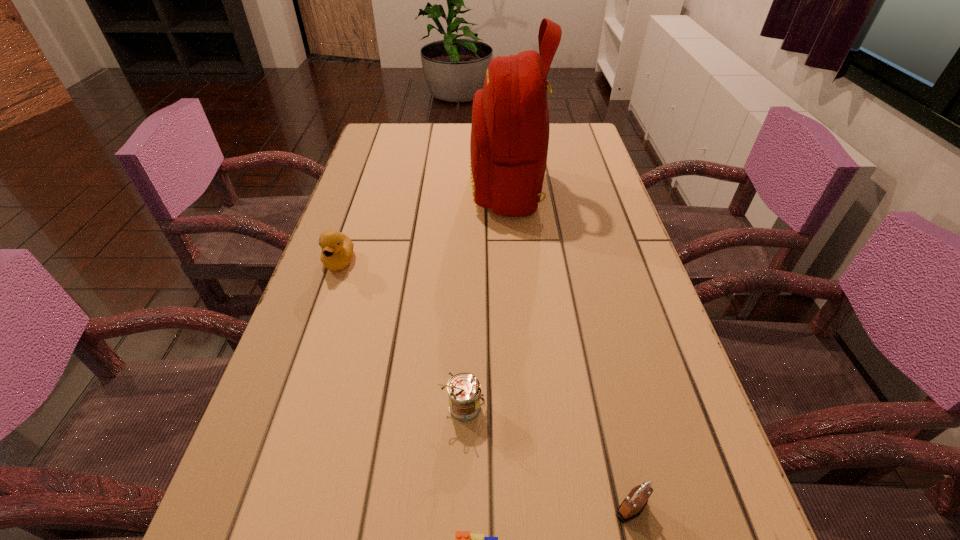
The image size is (960, 540). Identify the location of vacant region that satisfies the following two spatial constraints: 1. on the front-facing side of the backpack; 2. facing forward on the duckling. (513, 261).

You are a GUI agent. You are given a task and a screenshot of the screen. Output one action in this format:
    pyautogui.click(x=<x>, y=<y>)
    Task: Click on the vacant space that satisfies the following two spatial constraints: 1. on the front-facing side of the backpack; 2. facing forward on the leftmost object
    The height and width of the screenshot is (540, 960).
    Given the screenshot: What is the action you would take?
    pyautogui.click(x=513, y=261)

Locate an element on the screen. The width and height of the screenshot is (960, 540). vacant space that satisfies the following two spatial constraints: 1. facing forward on the duckling; 2. on the left side of the can is located at coordinates coord(289,409).

This screenshot has height=540, width=960. What are the coordinates of `free region that satisfies the following two spatial constraints: 1. on the front-facing side of the tallest object; 2. on the left side of the padlock` in the screenshot? It's located at (532, 508).

Locate an element on the screen. vacant space that satisfies the following two spatial constraints: 1. facing forward on the can; 2. on the left side of the leftmost object is located at coordinates (289, 409).